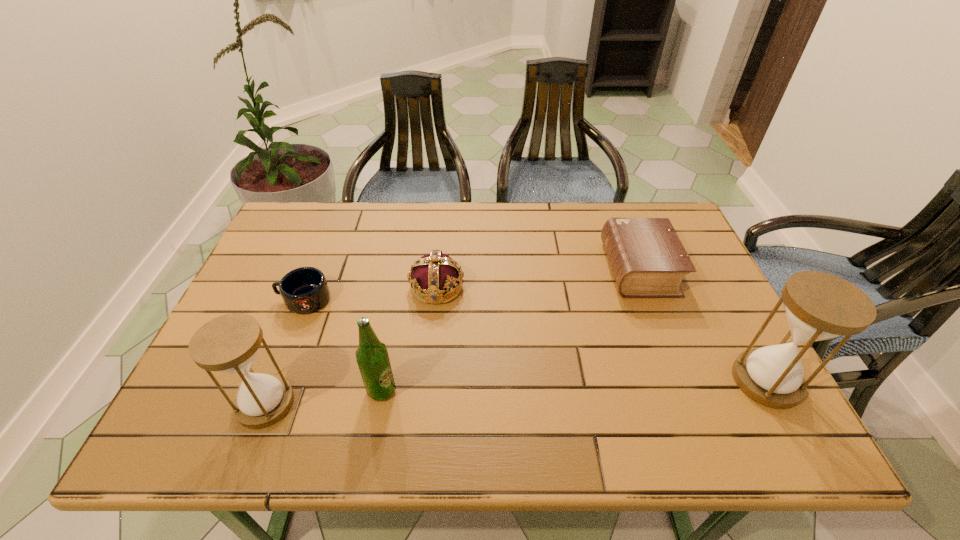
At what (x,y) coordinates should I click in order to perform the action: click on empty space between the Bible and the third shortest object. Please return your answer as a coordinate pair (x, y). The width and height of the screenshot is (960, 540). Looking at the image, I should click on (538, 278).

Point out which object is positioned as the fourth nearest to the beer bottle. Please provide its 2D coordinates. Your answer should be formatted as a tuple, i.e. [(x, y)], where the tuple contains the x and y coordinates of a point satisfying the conditions above.

[(648, 260)]

Locate an element on the screen. This screenshot has height=540, width=960. object that is the second nearest to the right hourglass is located at coordinates (434, 274).

Image resolution: width=960 pixels, height=540 pixels. What are the coordinates of `free location that satisfies the following two spatial constraints: 1. on the front side of the crown; 2. with the handle on the side of the shortest object` in the screenshot? It's located at (436, 299).

Locate an element on the screen. Image resolution: width=960 pixels, height=540 pixels. vacant region that satisfies the following two spatial constraints: 1. with the handle on the side of the shortest object; 2. on the right side of the taller hourglass is located at coordinates (273, 381).

Where is `vacant space that satisfies the following two spatial constraints: 1. on the spine side of the fifth object from left to right; 2. on the back side of the taller hourglass`? This screenshot has width=960, height=540. vacant space that satisfies the following two spatial constraints: 1. on the spine side of the fifth object from left to right; 2. on the back side of the taller hourglass is located at coordinates (682, 381).

Find the location of a particular element. This screenshot has width=960, height=540. free space that satisfies the following two spatial constraints: 1. on the front side of the taller hourglass; 2. on the label of the beer bottle is located at coordinates (772, 390).

Find the location of a particular element. Image resolution: width=960 pixels, height=540 pixels. free space that satisfies the following two spatial constraints: 1. on the back side of the right hourglass; 2. on the spine side of the Bible is located at coordinates (706, 269).

I want to click on free spot that satisfies the following two spatial constraints: 1. on the back side of the right hourglass; 2. with the handle on the side of the shortest object, so point(722,299).

Find the location of `vacant position in the image that satisfies the following two spatial constraints: 1. on the back side of the taller hourglass; 2. with the handle on the side of the shortest object`. vacant position in the image that satisfies the following two spatial constraints: 1. on the back side of the taller hourglass; 2. with the handle on the side of the shortest object is located at coordinates coord(722,299).